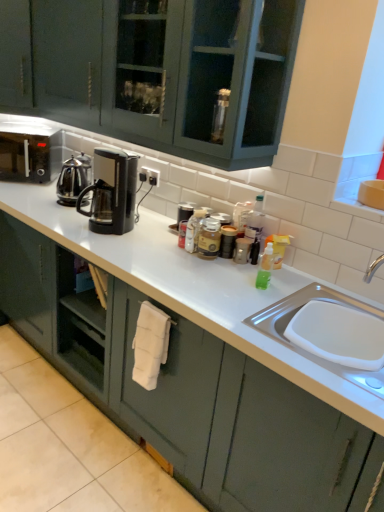
I want to click on vacant region to the left of metallic silver canister at center, which is the first appliance from left to right, so click(x=154, y=225).